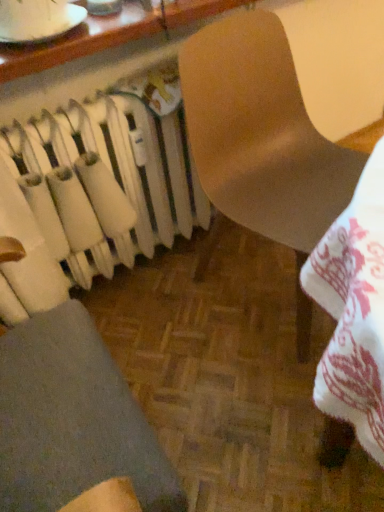
The width and height of the screenshot is (384, 512). What do you see at coordinates (106, 181) in the screenshot? I see `white matte radiator at left` at bounding box center [106, 181].

The height and width of the screenshot is (512, 384). Describe the element at coordinates (106, 36) in the screenshot. I see `matte wooden table at upper center` at that location.

You are a GUI agent. You are given a task and a screenshot of the screen. Output one action in this format:
    pyautogui.click(x=<x>, y=<y>)
    Task: Click on the white matte radiator at left
    
    Given the screenshot: What is the action you would take?
    pyautogui.click(x=106, y=181)

I want to click on table lying on the left of matte brown chair at center, so click(x=106, y=36).

Considering their positions, is matte wooden table at upper center located in front of or behind matte brown chair at center?

Visually, matte wooden table at upper center is located behind matte brown chair at center.

Is matte wooden table at upper center thinner than matte brown chair at center?

Indeed, matte wooden table at upper center has a lesser width compared to matte brown chair at center.

Is matte brown chair at center inside matte wooden table at upper center?

No, matte brown chair at center is not inside matte wooden table at upper center.

Is point (91, 48) positioned behind point (74, 255)?

No.

Would you say matte wooden table at upper center contains white matte radiator at left?

No, white matte radiator at left is not surrounded by matte wooden table at upper center.

From the image's perspective, is matte wooden table at upper center above or below white matte radiator at left?

Clearly, from the image's perspective, matte wooden table at upper center is above white matte radiator at left.

Is matte wooden table at upper center closer to the viewer compared to white matte radiator at left?

Yes.

Between white matte radiator at left and matte brown chair at center, which one has more height?

matte brown chair at center.

Would you say white matte radiator at left is to the left or to the right of matte brown chair at center in the picture?

In the image, white matte radiator at left appears on the left side of matte brown chair at center.

The image size is (384, 512). Find the location of `radiator below the matte brown chair at center (from a real-world perspective)`. radiator below the matte brown chair at center (from a real-world perspective) is located at coordinates (106, 181).

Can you confirm if white matte radiator at left is bigger than matte brown chair at center?

Actually, white matte radiator at left might be smaller than matte brown chair at center.

Where is `radiator lying on the left of matte wooden table at upper center`? radiator lying on the left of matte wooden table at upper center is located at coordinates (106, 181).

Can we say white matte radiator at left lies outside matte wooden table at upper center?

white matte radiator at left is positioned outside matte wooden table at upper center.

Is white matte radiator at left touching matte wooden table at upper center?

white matte radiator at left is not next to matte wooden table at upper center, and they're not touching.

From the picture: Is matte brown chair at center looking in the opposite direction of matte wooden table at upper center?

Yes, matte brown chair at center is positioned with its back facing matte wooden table at upper center.

Considering the sizes of objects matte brown chair at center and matte wooden table at upper center in the image provided, who is bigger, matte brown chair at center or matte wooden table at upper center?

matte brown chair at center is bigger.

Is matte brown chair at center completely or partially outside of matte wooden table at upper center?

Yes, matte brown chair at center is outside of matte wooden table at upper center.

Does matte brown chair at center lie in front of matte wooden table at upper center?

Yes, the depth of matte brown chair at center is less than that of matte wooden table at upper center.

From the image's perspective, between matte brown chair at center and white matte radiator at left, who is located below?

matte brown chair at center, from the image's perspective.

What's the angular difference between matte brown chair at center and white matte radiator at left's facing directions?

5.94 degrees.

From a real-world perspective, which is physically above, matte brown chair at center or white matte radiator at left?

matte brown chair at center is physically above.

The height and width of the screenshot is (512, 384). Find the location of `chair on the right side of white matte radiator at left`. chair on the right side of white matte radiator at left is located at coordinates (263, 140).

Where is `table above the matte brown chair at center (from a real-world perspective)`? table above the matte brown chair at center (from a real-world perspective) is located at coordinates (106, 36).

You are a GUI agent. You are given a task and a screenshot of the screen. Output one action in this format:
    pyautogui.click(x=<x>, y=<y>)
    Task: Click on the radiator located underneath the matte wooden table at upper center (from a real-world perspective)
    The height and width of the screenshot is (512, 384).
    Given the screenshot: What is the action you would take?
    pyautogui.click(x=106, y=181)

Which object lies further to the anchor point matte brown chair at center, matte wooden table at upper center or white matte radiator at left?

Based on the image, matte wooden table at upper center appears to be further to matte brown chair at center.

Based on their spatial positions, is white matte radiator at left or matte wooden table at upper center closer to matte brown chair at center?

Based on the image, white matte radiator at left appears to be nearer to matte brown chair at center.

Based on their spatial positions, is white matte radiator at left or matte brown chair at center closer to matte wooden table at upper center?

Among the two, matte brown chair at center is located nearer to matte wooden table at upper center.

Considering their positions, is matte brown chair at center positioned closer to matte wooden table at upper center than white matte radiator at left?

matte brown chair at center is closer to matte wooden table at upper center.

From the image, which object appears to be farther from white matte radiator at left, matte brown chair at center or matte wooden table at upper center?

matte wooden table at upper center.

When comparing their distances from white matte radiator at left, does matte wooden table at upper center or matte brown chair at center seem further?

Among the two, matte wooden table at upper center is located further to white matte radiator at left.

At what (x,y) coordinates should I click in order to perform the action: click on table situated between white matte radiator at left and matte brown chair at center from left to right. Please return your answer as a coordinate pair (x, y). The height and width of the screenshot is (512, 384). Looking at the image, I should click on (106, 36).